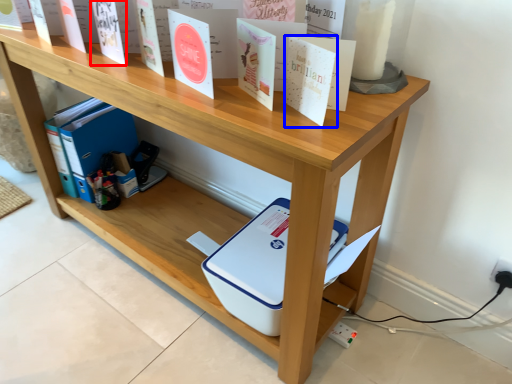
Question: Which object appears closest to the camera in this image, paperback book (highlighted by a red box) or paperback book (highlighted by a blue box)?

Choices:
 (A) paperback book
 (B) paperback book

Answer: (B)